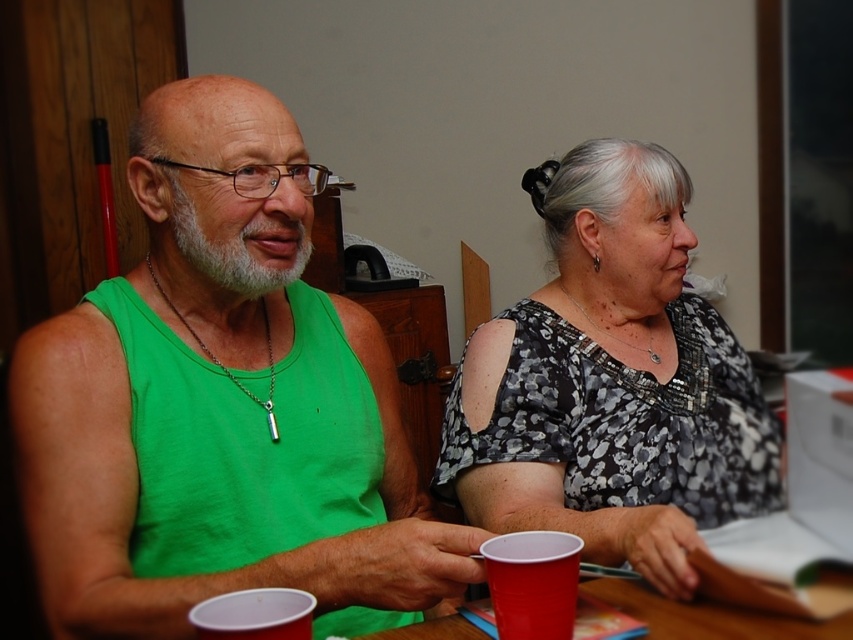
Question: Which point appears farthest from the camera in this image?

Choices:
 (A) (96, 545)
 (B) (408, 632)
 (C) (268, 621)
 (D) (567, 630)

Answer: (A)

Question: Can you confirm if smooth wooden table at center is positioned to the right of matte plastic cup at lower center?

Choices:
 (A) no
 (B) yes

Answer: (B)

Question: Which of the following is the farthest from the observer?

Choices:
 (A) matte plastic cup at lower left
 (B) floral-patterned blouse at center

Answer: (B)

Question: Does floral-patterned blouse at center have a lesser width compared to matte plastic cup at lower center?

Choices:
 (A) no
 (B) yes

Answer: (A)

Question: Observing the image, what is the correct spatial positioning of green fabric tank top at left in reference to matte plastic cup at lower center?

Choices:
 (A) right
 (B) left

Answer: (B)

Question: Which point is closer to the camera?

Choices:
 (A) coord(605,582)
 (B) coord(199,637)

Answer: (B)